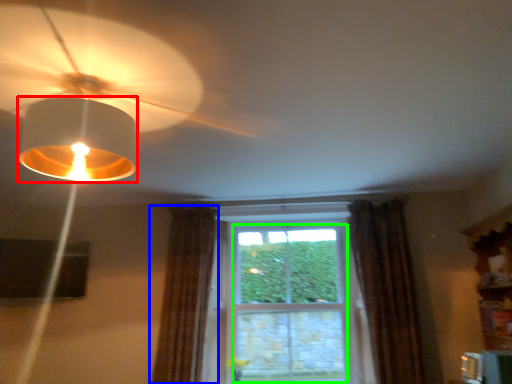
Question: Which object is positioned closest to lamp (highlighted by a red box)? Select from curtain (highlighted by a blue box) and bay window (highlighted by a green box).

Choices:
 (A) curtain
 (B) bay window

Answer: (A)